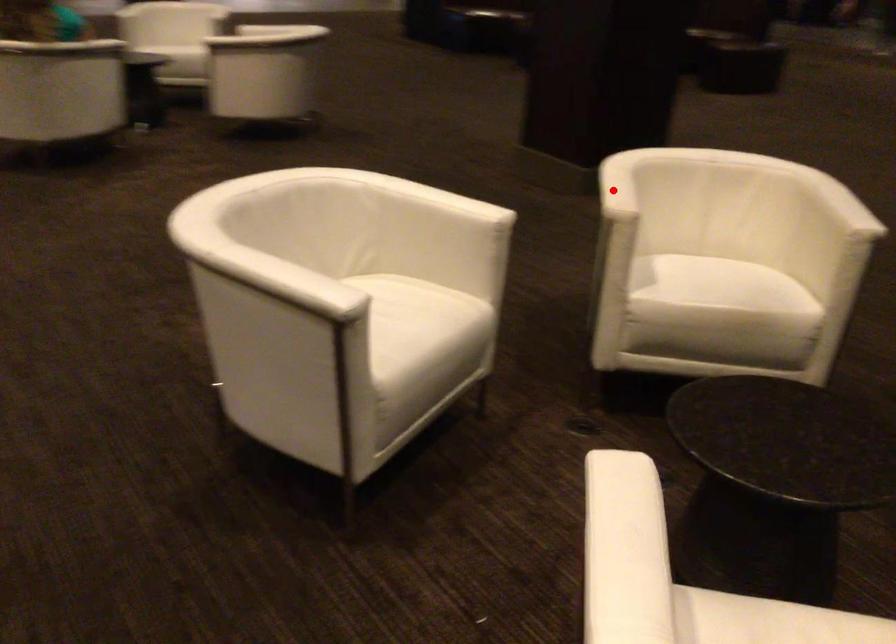
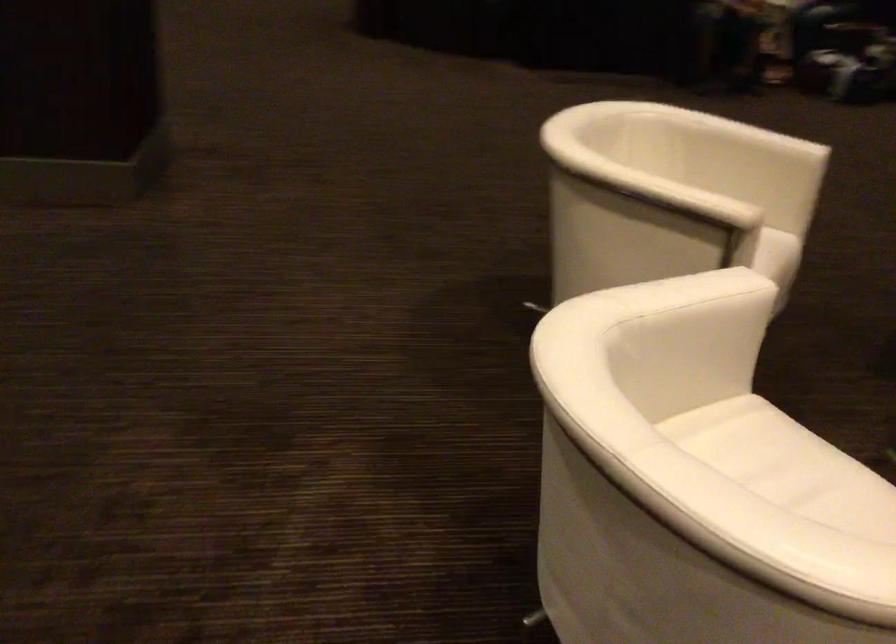
The point at the highlighted location is marked in the first image. Where is the corresponding point in the second image?

(675, 194)